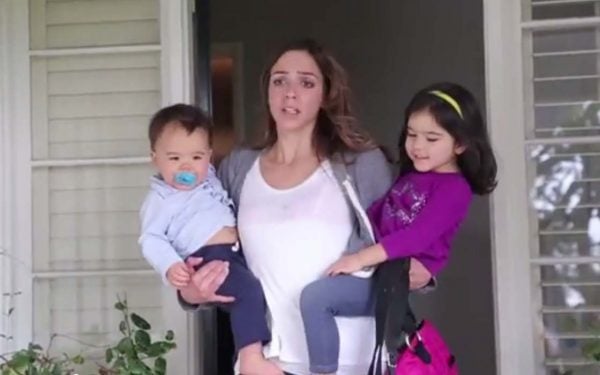
The height and width of the screenshot is (375, 600). Identify the location of plant. (139, 345).